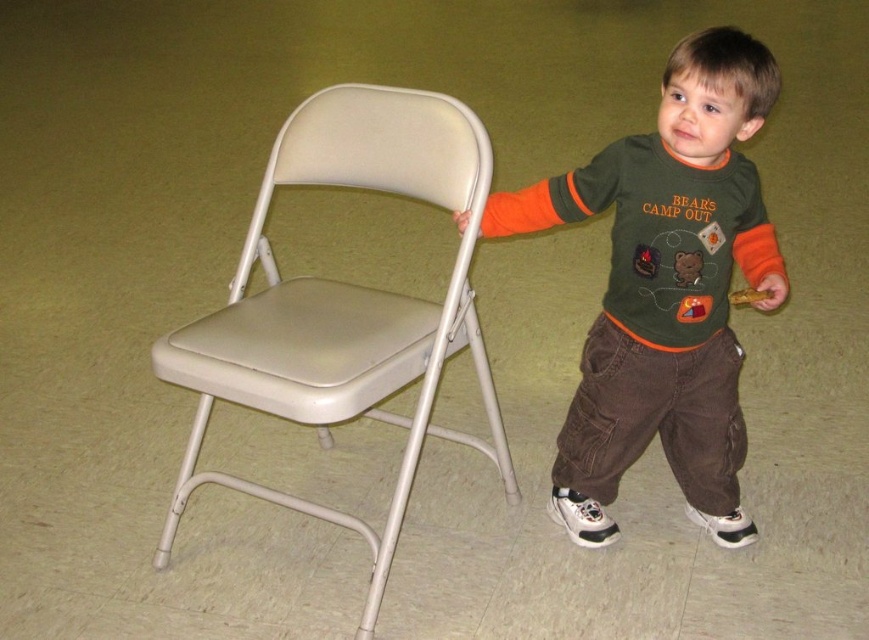
Question: In this image, where is green cotton shirt at center located relative to beige plastic folding chair at left?

Choices:
 (A) left
 (B) right

Answer: (B)

Question: Which of the following is the closest to the observer?

Choices:
 (A) (768, 276)
 (B) (324, 314)

Answer: (A)

Question: Does green cotton shirt at center appear over beige plastic folding chair at left?

Choices:
 (A) yes
 (B) no

Answer: (A)

Question: Is green cotton shirt at center behind beige plastic folding chair at left?

Choices:
 (A) no
 (B) yes

Answer: (B)

Question: Which point is farther to the camera?

Choices:
 (A) green cotton shirt at center
 (B) beige plastic folding chair at left

Answer: (A)